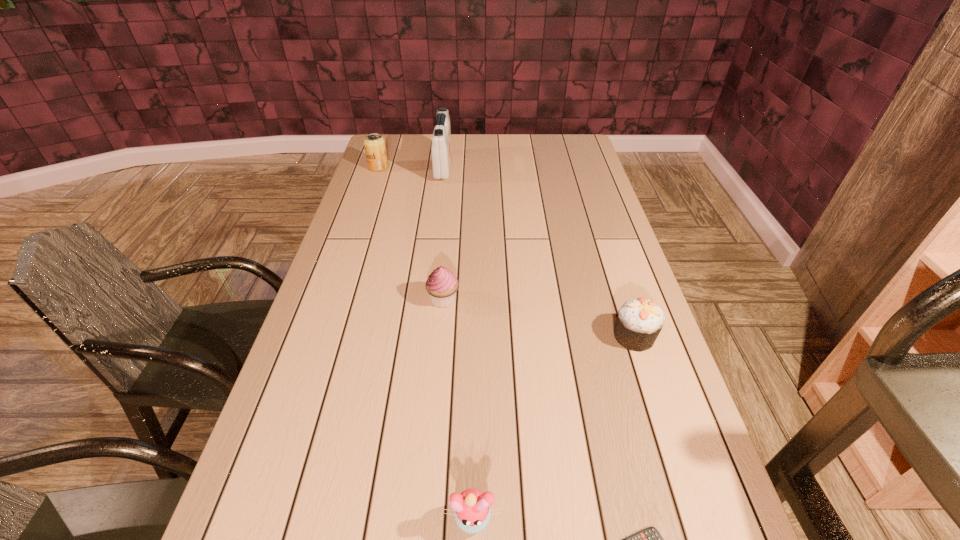
The image size is (960, 540). Find the location of `free spot between the nearest cupcake and the tallest object`. free spot between the nearest cupcake and the tallest object is located at coordinates (458, 342).

I want to click on the closest object to the third nearest object, so click(x=649, y=539).

Choose which object is the third nearest neighbor to the calculator. Please provide its 2D coordinates. Your answer should be formatted as a tuple, i.e. [(x, y)], where the tuple contains the x and y coordinates of a point satisfying the conditions above.

[(442, 284)]

Locate an element on the screen. This screenshot has height=540, width=960. cupcake that is the second closest to the nearest cupcake is located at coordinates (442, 284).

The height and width of the screenshot is (540, 960). I want to click on cupcake that is the second closest to the leftmost object, so click(639, 322).

Locate an element on the screen. This screenshot has width=960, height=540. free space that satisfies the following two spatial constraints: 1. on the front side of the leftmost object; 2. on the right side of the third farthest object is located at coordinates (334, 299).

Identify the location of free space that satisfies the following two spatial constraints: 1. on the front side of the farthest cupcake; 2. on the left side of the tallest object. (427, 299).

Locate an element on the screen. This screenshot has width=960, height=540. vacant point that satisfies the following two spatial constraints: 1. on the front side of the third farthest object; 2. on the right side of the tallest object is located at coordinates (427, 299).

Locate an element on the screen. This screenshot has width=960, height=540. free point that satisfies the following two spatial constraints: 1. on the front side of the tallest object; 2. on the left side of the second nearest cupcake is located at coordinates (422, 336).